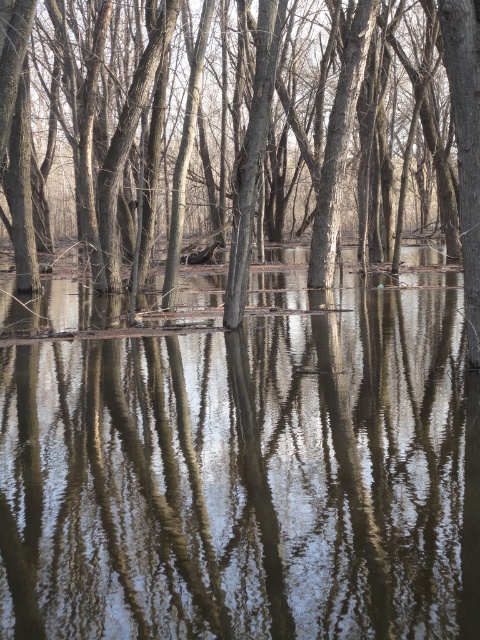
From the picture: You are standing in the forest and see the clear water at center and the smooth bark tree at center. Which object is positioned to the right of the other?

The clear water at center is to the right of the smooth bark tree at center.

You are standing in the forest scene and want to walk from the point at coordinates point (97, 548) to the point at coordinates point (346, 22). Since the water has flooded the area, will you need to wade through water to reach your destination?

Since point (97, 548) is in front of point (346, 22), you would need to walk towards the direction of point (346, 22). However, the scene describes submerged lower parts of trees, indicating water is present in the lower areas. Therefore, you might encounter water along the path, so wading through water is likely necessary to reach the destination.